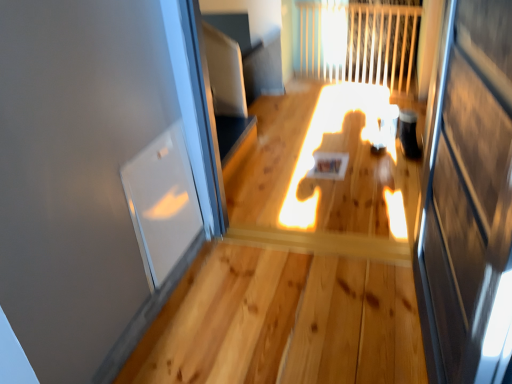
Question: From a real-world perspective, is transparent glass window at left located beneath transparent glass screen door at right?

Choices:
 (A) yes
 (B) no

Answer: (A)

Question: Would you say transparent glass screen door at right is part of transparent glass window at left's contents?

Choices:
 (A) no
 (B) yes

Answer: (A)

Question: From a real-world perspective, is transparent glass window at left physically above transparent glass screen door at right?

Choices:
 (A) yes
 (B) no

Answer: (B)

Question: Is transparent glass window at left thinner than transparent glass screen door at right?

Choices:
 (A) yes
 (B) no

Answer: (A)

Question: From the image's perspective, does transparent glass window at left appear higher than transparent glass screen door at right?

Choices:
 (A) no
 (B) yes

Answer: (B)

Question: Is transparent glass window at left at the left side of transparent glass screen door at right?

Choices:
 (A) no
 (B) yes

Answer: (B)

Question: Is transparent glass screen door at right positioned with its back to transparent glass window at left?

Choices:
 (A) no
 (B) yes

Answer: (A)

Question: Considering the relative sizes of transparent glass screen door at right and transparent glass window at left in the image provided, is transparent glass screen door at right shorter than transparent glass window at left?

Choices:
 (A) yes
 (B) no

Answer: (B)

Question: Is transparent glass screen door at right thinner than transparent glass window at left?

Choices:
 (A) no
 (B) yes

Answer: (A)

Question: Can you confirm if transparent glass screen door at right is taller than transparent glass window at left?

Choices:
 (A) yes
 (B) no

Answer: (A)

Question: From the image's perspective, does transparent glass screen door at right appear higher than transparent glass window at left?

Choices:
 (A) no
 (B) yes

Answer: (A)

Question: Considering the relative sizes of transparent glass screen door at right and transparent glass window at left in the image provided, is transparent glass screen door at right wider than transparent glass window at left?

Choices:
 (A) no
 (B) yes

Answer: (B)

Question: Is transparent glass window at left bigger or smaller than transparent glass screen door at right?

Choices:
 (A) big
 (B) small

Answer: (B)